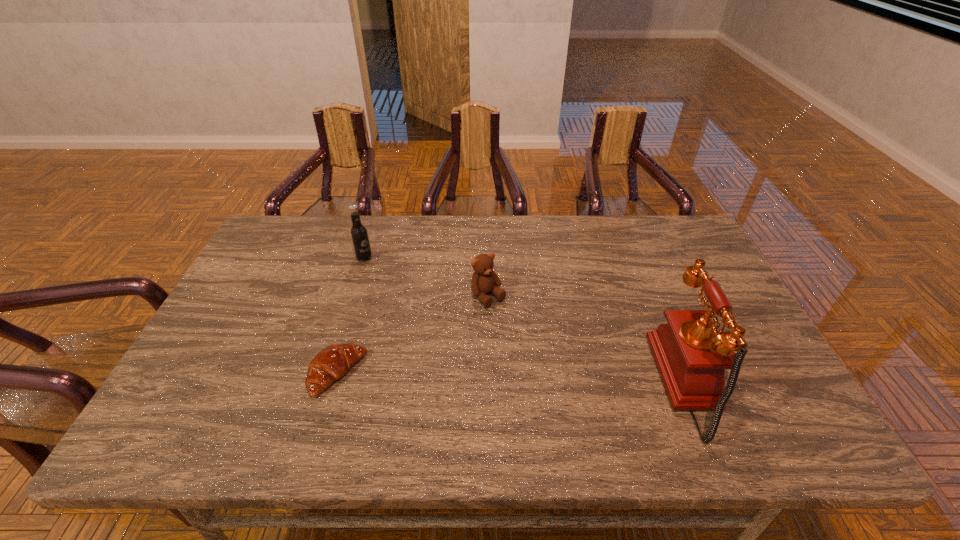
This screenshot has width=960, height=540. I want to click on free area in between the farthest object and the tallest object, so click(x=530, y=321).

Identify the location of free area in between the farthest object and the third nearest object. (426, 277).

Find the location of a particular element. vacant space in between the telephone and the crescent roll is located at coordinates (516, 379).

The width and height of the screenshot is (960, 540). What are the coordinates of `free point between the tallest object and the teddy bear` in the screenshot? It's located at (591, 340).

Select which object is the third closest to the telephone. Please provide its 2D coordinates. Your answer should be formatted as a tuple, i.e. [(x, y)], where the tuple contains the x and y coordinates of a point satisfying the conditions above.

[(359, 235)]

In order to click on object that stands as the third closest to the telephone in this screenshot , I will do `click(359, 235)`.

Locate an element on the screen. The width and height of the screenshot is (960, 540). vacant space that satisfies the following two spatial constraints: 1. on the front side of the farthest object; 2. on the left side of the shortest object is located at coordinates (328, 375).

You are a GUI agent. You are given a task and a screenshot of the screen. Output one action in this format:
    pyautogui.click(x=<x>, y=<y>)
    Task: Click on the vacant space that satisfies the following two spatial constraints: 1. on the front side of the teddy bear; 2. on the right side of the root beer
    
    Given the screenshot: What is the action you would take?
    pyautogui.click(x=352, y=296)

Where is `vacant region that satisfies the following two spatial constraints: 1. on the front side of the rightmost object; 2. on the dial of the third shortest object`? vacant region that satisfies the following two spatial constraints: 1. on the front side of the rightmost object; 2. on the dial of the third shortest object is located at coordinates (325, 384).

Where is `free space that satisfies the following two spatial constraints: 1. on the front side of the crescent roll; 2. on the dial of the telephone`? Image resolution: width=960 pixels, height=540 pixels. free space that satisfies the following two spatial constraints: 1. on the front side of the crescent roll; 2. on the dial of the telephone is located at coordinates tap(334, 384).